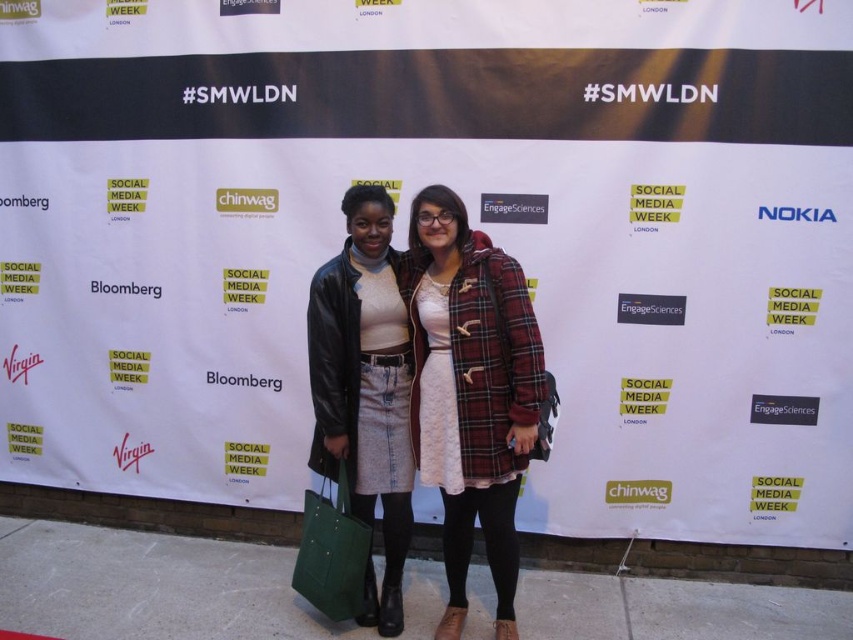
Which of these two, plaid wool coat at center or green fabric tote at lower center, stands taller?

plaid wool coat at center

Who is more forward, (421,474) or (363,552)?

Point (363,552) is in front.

You are a GUI agent. You are given a task and a screenshot of the screen. Output one action in this format:
    pyautogui.click(x=<x>, y=<y>)
    Task: Click on the plaid wool coat at center
    Image resolution: width=853 pixels, height=640 pixels.
    Given the screenshot: What is the action you would take?
    tap(469, 392)

Between matte black jacket at center and green fabric tote at lower center, which one is positioned lower?

green fabric tote at lower center is lower down.

Can you confirm if matte black jacket at center is positioned above green fabric tote at lower center?

Yes, matte black jacket at center is above green fabric tote at lower center.

Who is more forward, (352,413) or (358,579)?

Positioned in front is point (358,579).

Image resolution: width=853 pixels, height=640 pixels. I want to click on matte black jacket at center, so click(x=364, y=387).

Is point (460, 280) closer to camera compared to point (403, 305)?

Yes, point (460, 280) is closer to viewer.

Find the location of a particular element. plaid wool coat at center is located at coordinates (469, 392).